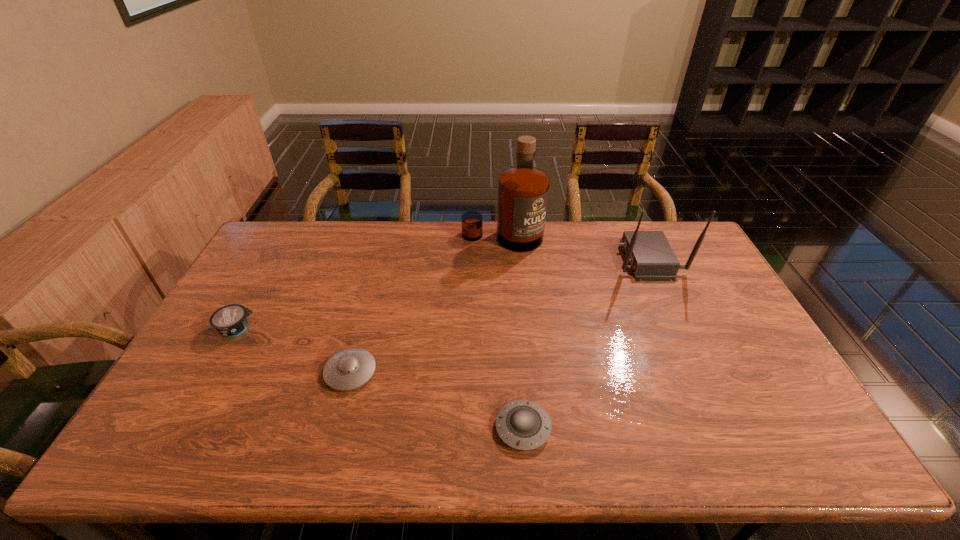
This screenshot has width=960, height=540. I want to click on free space between the liquor and the yogurt, so click(370, 284).

Find the location of a particular element. The width and height of the screenshot is (960, 540). vacant region between the nearest object and the rightmost object is located at coordinates (585, 343).

At what (x,y) coordinates should I click in order to perform the action: click on free space that is in between the router and the liquor. Please return your answer as a coordinate pair (x, y). This screenshot has height=540, width=960. Looking at the image, I should click on (575, 249).

What are the coordinates of `free space between the liquor and the second object from left to right` in the screenshot? It's located at (426, 305).

Locate an element on the screen. empty space between the rightmost object and the fourth object from right to left is located at coordinates point(499,316).

The width and height of the screenshot is (960, 540). I want to click on the third closest object to the second tallest object, so click(349, 369).

This screenshot has width=960, height=540. I want to click on the fourth closest object to the shorter saucer, so click(231, 320).

Where is `free location that satisfies the following two spatial constraints: 1. on the front side of the nearer saucer; 2. on the right side of the third shortest object`? free location that satisfies the following two spatial constraints: 1. on the front side of the nearer saucer; 2. on the right side of the third shortest object is located at coordinates (183, 428).

Locate an element on the screen. The height and width of the screenshot is (540, 960). vacant area in the image that satisfies the following two spatial constraints: 1. on the front label of the tallest object; 2. on the right side of the shorter saucer is located at coordinates (515, 428).

Identify the location of free region that satisfies the following two spatial constraints: 1. on the back of the rightmost object to connect cables; 2. on the front side of the farther saucer. (699, 372).